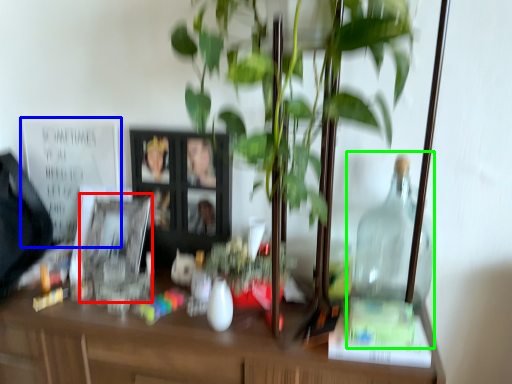
Question: Based on their relative distances, which object is nearer to picture frame (highlighted by a red box)? Choose from bulletin board (highlighted by a blue box) and glass jar (highlighted by a green box).

Choices:
 (A) bulletin board
 (B) glass jar

Answer: (A)